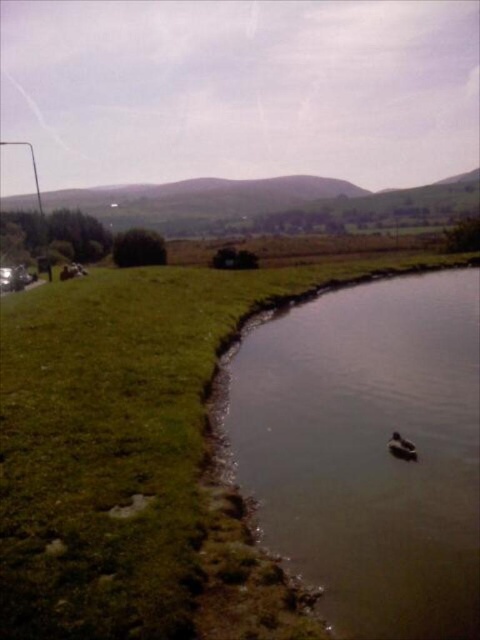
From the picture: You are standing at the origin point of the coordinate system. You want to reach the green matte lake at center. What are the coordinates you need to move to?

The coordinates you need to move to are approximately 0.703 on the x axis and 0.762 on the y axis.

You are a photographer trying to capture the brown fuzzy duck at lower right and the green matte lake at center in a single shot. Based on their positions, will the duck appear smaller in the photo compared to the lake?

The green matte lake at center is much taller than the brown fuzzy duck at lower right, so yes, the duck will appear smaller in the photo compared to the lake.

You are standing at the origin point in the image and want to reach the point labeled point (422,470). Which direction should you move relative to point (388,448)?

To reach point (422,470), you should move in the direction that is in front of point (388,448) since point (422,470) is located in front of point (388,448).